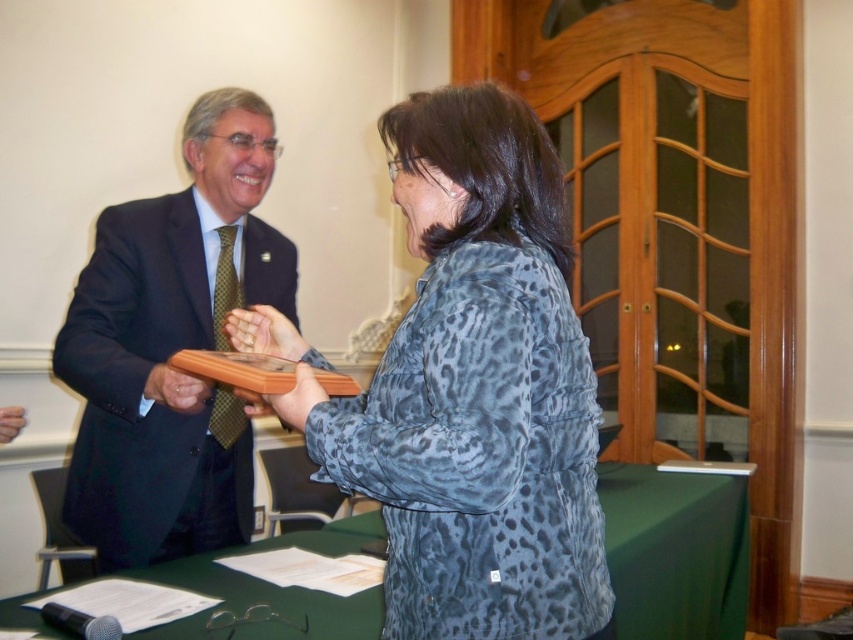
You are organizing a photo shoot and need to ensure that the matte black suit at left and the green fabric table at center are visible in the frame. Given their sizes, which object should you prioritize positioning closer to the camera to maintain clarity?

The matte black suit at left is smaller than the green fabric table at center, so you should prioritize positioning the matte black suit at left closer to the camera to ensure it remains visible and clear in the photo shoot frame.

You are a security guard in a conference hall and need to move a 1.5 meter long box from the green fabric table at center to the matte black suit at left. Can you move the box without tilting it sideways?

The distance between the matte black suit at left and the green fabric table at center is 1.26 meters. Since the box is 1.5 meters long, it cannot be moved horizontally without tilting it sideways because the distance is shorter than the box length.

Based on the photo, you are standing at the camera position and want to place a 1.2 meter long banner between you and the point at point (421, 400). Will the banner fit without overlapping the point?

The distance between you and the point at point (421, 400) is 1.08 meters. Since the banner is 1.2 meters long, it will extend beyond the point, overlapping it by 0.12 meters.